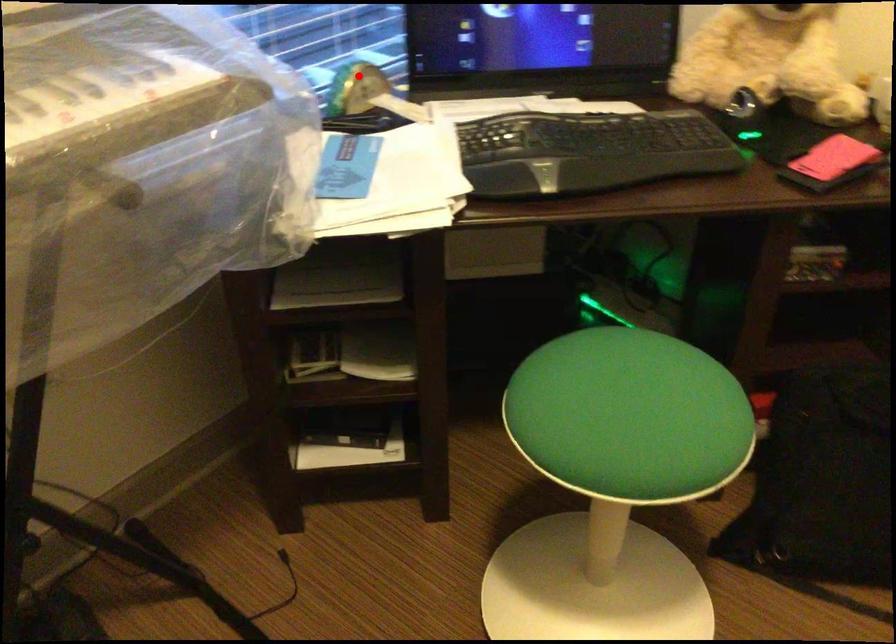
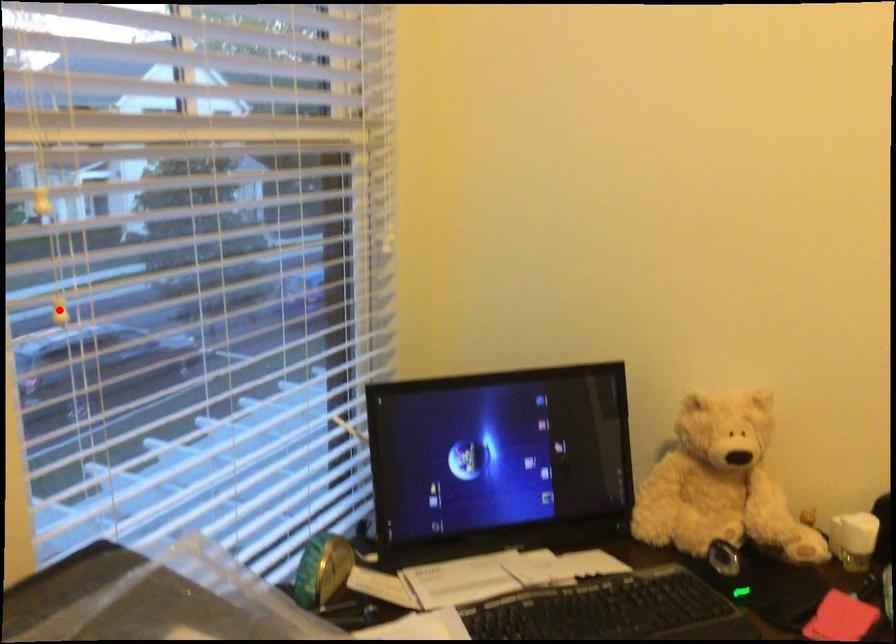
I am providing you with two images of the same scene from different viewpoints. A red point is marked on the first image and another point is marked on the second image. Does the point marked in image1 correspond to the same location as the one in image2?

No